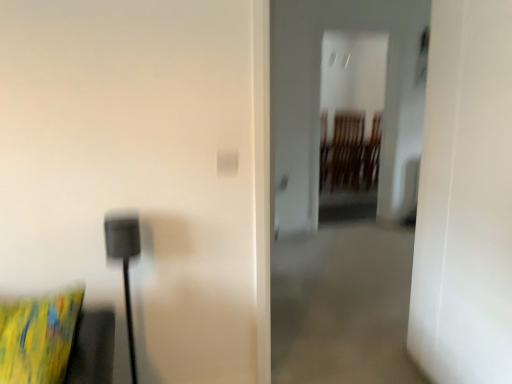
Question: Considering their positions, is yellow fabric pillow at lower left located in front of or behind transparent glass door at center?

Choices:
 (A) front
 (B) behind

Answer: (A)

Question: In terms of width, does yellow fabric pillow at lower left look wider or thinner when compared to transparent glass door at center?

Choices:
 (A) thin
 (B) wide

Answer: (B)

Question: From the image's perspective, is yellow fabric pillow at lower left located above or below transparent glass door at center?

Choices:
 (A) below
 (B) above

Answer: (A)

Question: Considering the positions of transparent glass door at center and yellow fabric pillow at lower left in the image, is transparent glass door at center wider or thinner than yellow fabric pillow at lower left?

Choices:
 (A) thin
 (B) wide

Answer: (A)

Question: Is transparent glass door at center to the left or to the right of yellow fabric pillow at lower left in the image?

Choices:
 (A) right
 (B) left

Answer: (A)

Question: Is transparent glass door at center bigger or smaller than yellow fabric pillow at lower left?

Choices:
 (A) big
 (B) small

Answer: (A)

Question: From a real-world perspective, is transparent glass door at center positioned above or below yellow fabric pillow at lower left?

Choices:
 (A) above
 (B) below

Answer: (A)